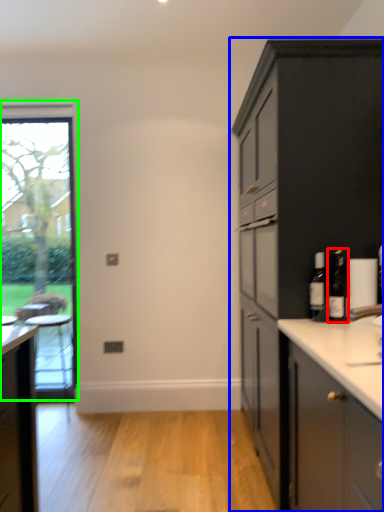
Question: Which object is the closest to the bottle (highlighted by a red box)? Choose among these: cabinetry (highlighted by a blue box) or window (highlighted by a green box).

Choices:
 (A) cabinetry
 (B) window

Answer: (A)